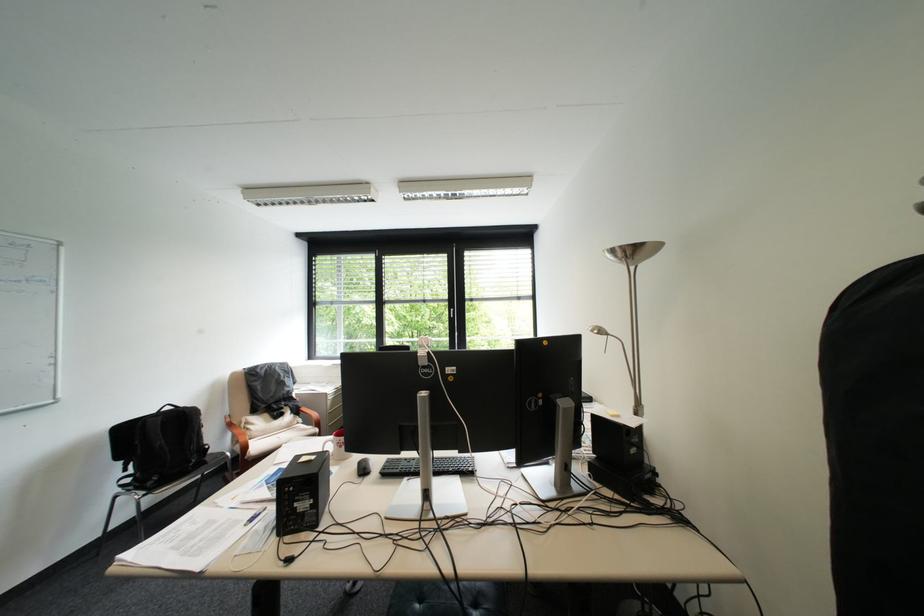
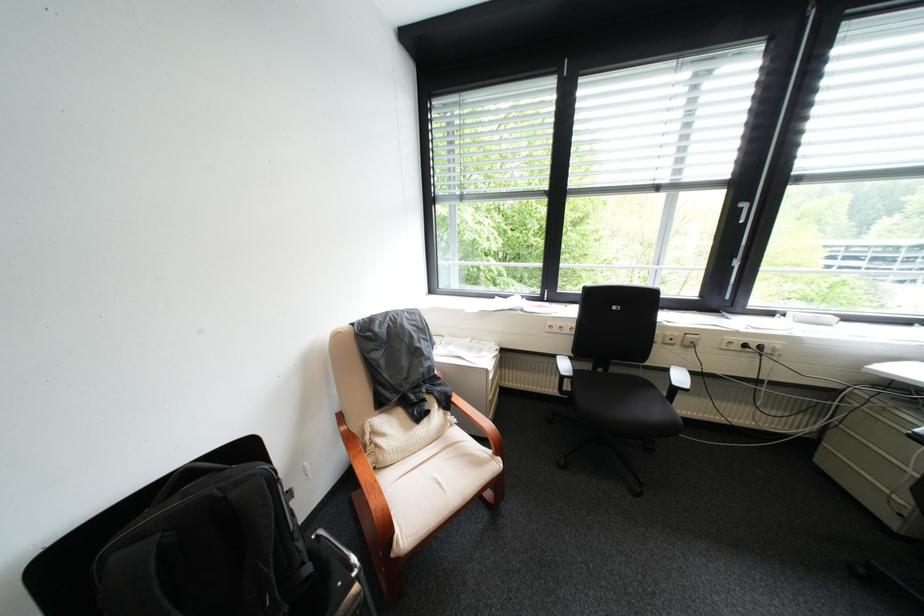
In a continuous first-person perspective shot, in which direction is the camera moving?

The cameraman moved toward left, forward.